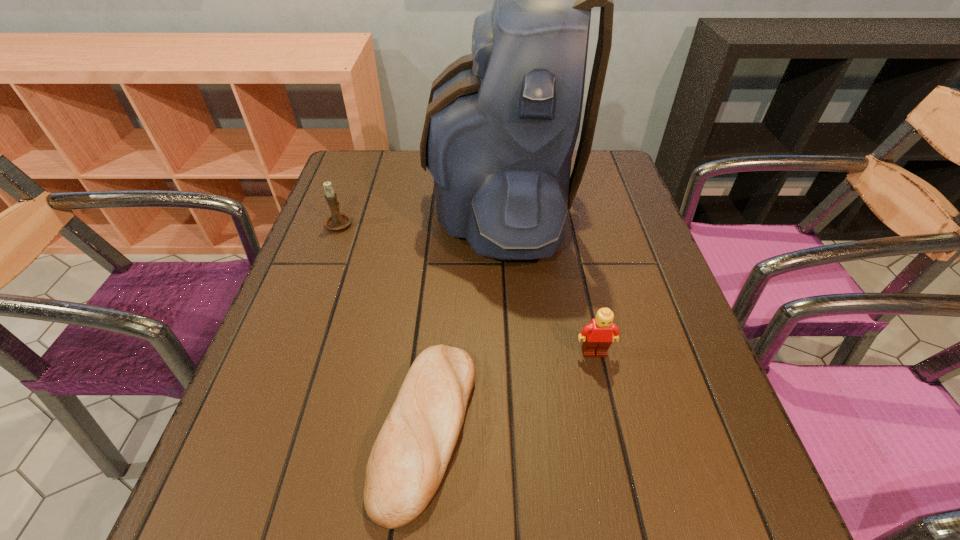
The image size is (960, 540). In order to click on empty space between the Lego and the candle holder in this screenshot , I will do `click(467, 287)`.

Where is `free spot between the shortest object and the candle holder`? free spot between the shortest object and the candle holder is located at coordinates (383, 326).

Identify the location of empty space between the candle holder and the tallest object. (420, 214).

You are a GUI agent. You are given a task and a screenshot of the screen. Output one action in this format:
    pyautogui.click(x=<x>, y=<y>)
    Task: Click on the free spot between the candle holder and the shortest object
    
    Given the screenshot: What is the action you would take?
    pyautogui.click(x=383, y=326)

Identify the location of free space between the backpack and the Lego. (546, 279).

Identify the location of unoccupied position between the backpack and the Lego. (546, 279).

You are a GUI agent. You are given a task and a screenshot of the screen. Output one action in this format:
    pyautogui.click(x=<x>, y=<y>)
    Task: Click on the vacant point located between the Lego and the backpack
    
    Given the screenshot: What is the action you would take?
    pyautogui.click(x=546, y=279)

This screenshot has width=960, height=540. Find the location of `free point between the tallest object and the shortest object`. free point between the tallest object and the shortest object is located at coordinates (463, 317).

Image resolution: width=960 pixels, height=540 pixels. What are the coordinates of `empty location between the candle holder and the tallest object` in the screenshot? It's located at (420, 214).

Locate an element on the screen. free space between the Lego and the bread is located at coordinates (510, 390).